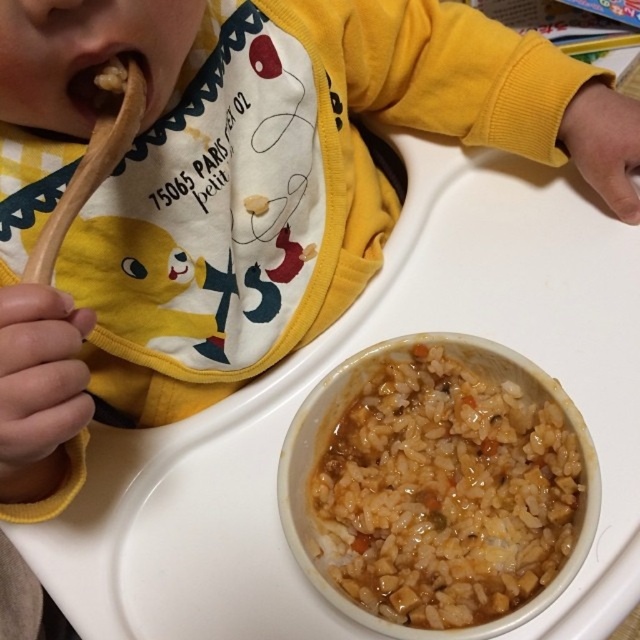
Question: Based on their relative distances, which object is farther from the wooden spoon at upper left?

Choices:
 (A) brown matte food at mouth left
 (B) brown matte rice at center

Answer: (B)

Question: Can you confirm if brown matte rice at center is thinner than brown matte food at mouth left?

Choices:
 (A) no
 (B) yes

Answer: (A)

Question: Which of the following is the closest to the observer?

Choices:
 (A) pyautogui.click(x=314, y=508)
 (B) pyautogui.click(x=35, y=248)
 (C) pyautogui.click(x=129, y=80)

Answer: (B)

Question: Can you confirm if brown matte rice at center is smaller than brown matte food at mouth left?

Choices:
 (A) no
 (B) yes

Answer: (A)

Question: Is brown matte rice at center above wooden spoon at upper left?

Choices:
 (A) no
 (B) yes

Answer: (A)

Question: Among these points, which one is farthest from the camera?

Choices:
 (A) (339, 572)
 (B) (109, 60)

Answer: (A)